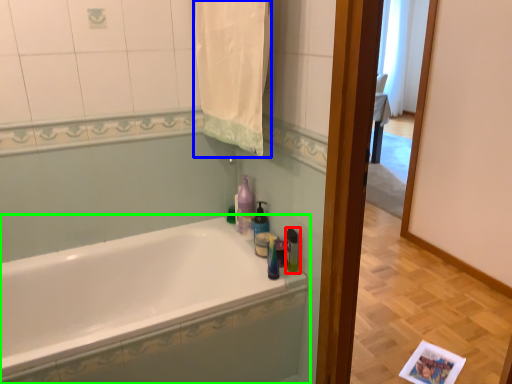
Question: Which object is the closest to the toiletry (highlighted by a red box)? Choose among these: bath towel (highlighted by a blue box) or bathtub (highlighted by a green box).

Choices:
 (A) bath towel
 (B) bathtub

Answer: (B)